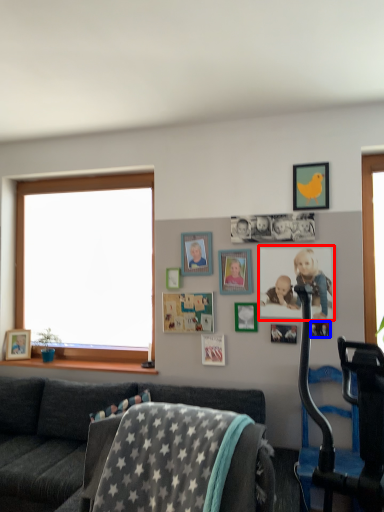
Question: Which of the following is the farthest to the observer, picture frame (highlighted by a red box) or picture frame (highlighted by a blue box)?

Choices:
 (A) picture frame
 (B) picture frame

Answer: (B)